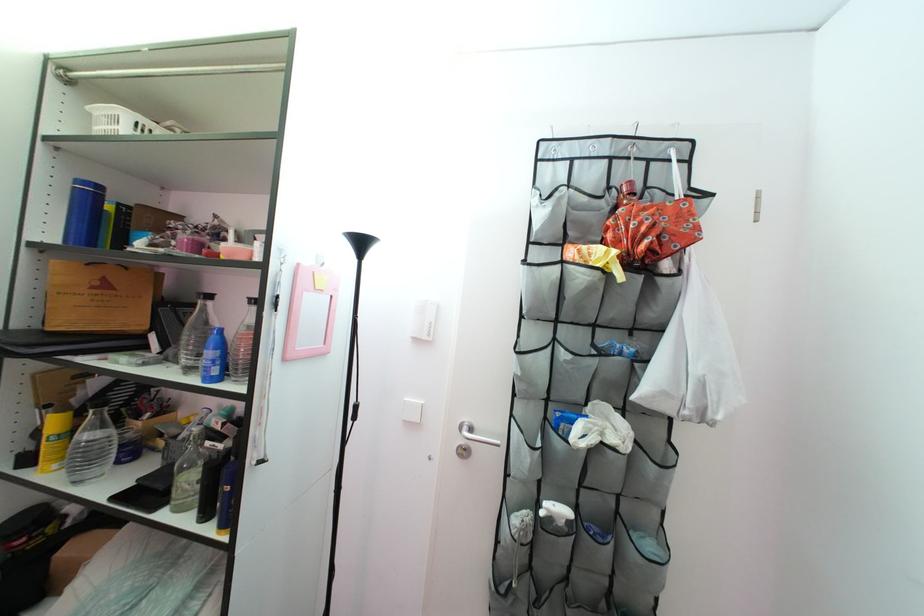
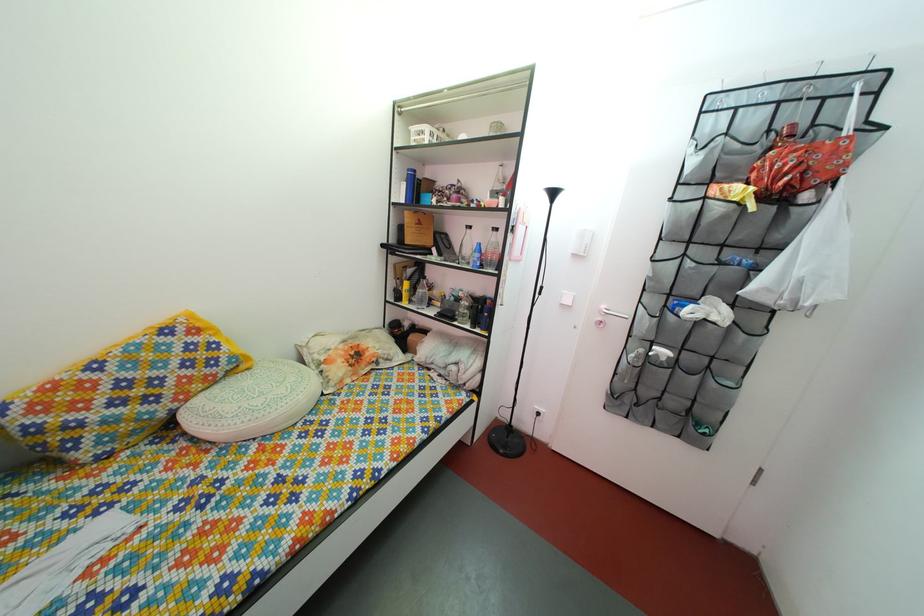
Question: The camera is either moving clockwise (left) or counter-clockwise (right) around the object. The first image is from the beginning of the video and the second image is from the end. Is the camera moving left or right when shooting the video?

Choices:
 (A) Left
 (B) Right

Answer: (B)